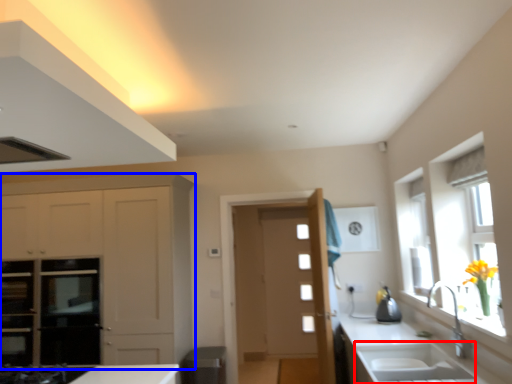
Question: Which object appears farthest to the camera in this image, sink (highlighted by a red box) or cabinetry (highlighted by a blue box)?

Choices:
 (A) sink
 (B) cabinetry

Answer: (B)